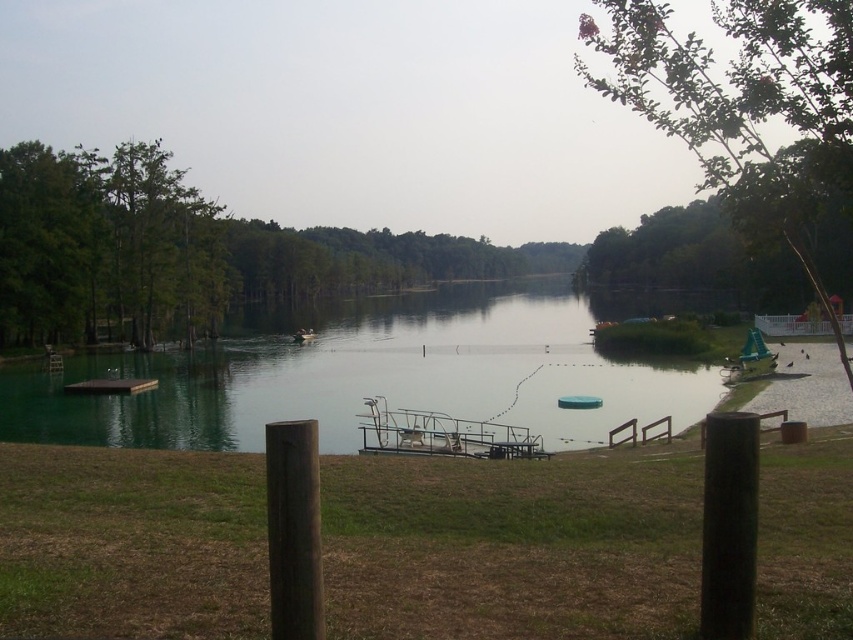
Who is positioned more to the right, green matte dock at lower left or green plastic boat at right?

green plastic boat at right

Is point (85, 387) more distant than point (743, 358)?

No, it is in front of (743, 358).

Locate an element on the screen. This screenshot has height=640, width=853. green matte dock at lower left is located at coordinates (109, 387).

Who is taller, green plastic boat at right or teal matte boat at center?

green plastic boat at right is taller.

Does point (756, 333) lie behind point (595, 404)?

Yes.

Who is more forward, (747, 333) or (585, 403)?

Point (585, 403) is more forward.

This screenshot has height=640, width=853. In order to click on green plastic boat at right in this screenshot , I will do `click(753, 348)`.

Between teal matte boat at center and green plastic boat at center, which one appears on the left side from the viewer's perspective?

From the viewer's perspective, green plastic boat at center appears more on the left side.

Is teal matte boat at center wider than green plastic boat at center?

No.

Locate an element on the screen. The width and height of the screenshot is (853, 640). teal matte boat at center is located at coordinates (x=579, y=401).